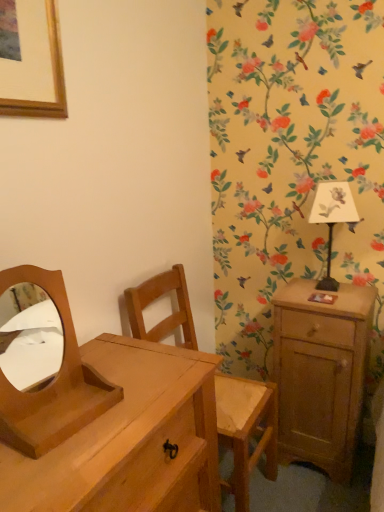
Question: From their relative heights in the image, would you say wooden swivel chair at center is taller or shorter than wooden/matte mirror at left?

Choices:
 (A) short
 (B) tall

Answer: (B)

Question: From a real-world perspective, is wooden swivel chair at center above or below wooden/matte mirror at left?

Choices:
 (A) above
 (B) below

Answer: (B)

Question: Which object is positioned closest to the light brown wooden chest of drawers at lower left?

Choices:
 (A) wooden swivel chair at center
 (B) light brown wood nightstand at right
 (C) white paper lampshade at upper right
 (D) wooden/matte mirror at left

Answer: (D)

Question: Which of these objects is positioned farthest from the light brown wood nightstand at right?

Choices:
 (A) light brown wooden chest of drawers at lower left
 (B) wooden swivel chair at center
 (C) wooden/matte mirror at left
 (D) white paper lampshade at upper right

Answer: (C)